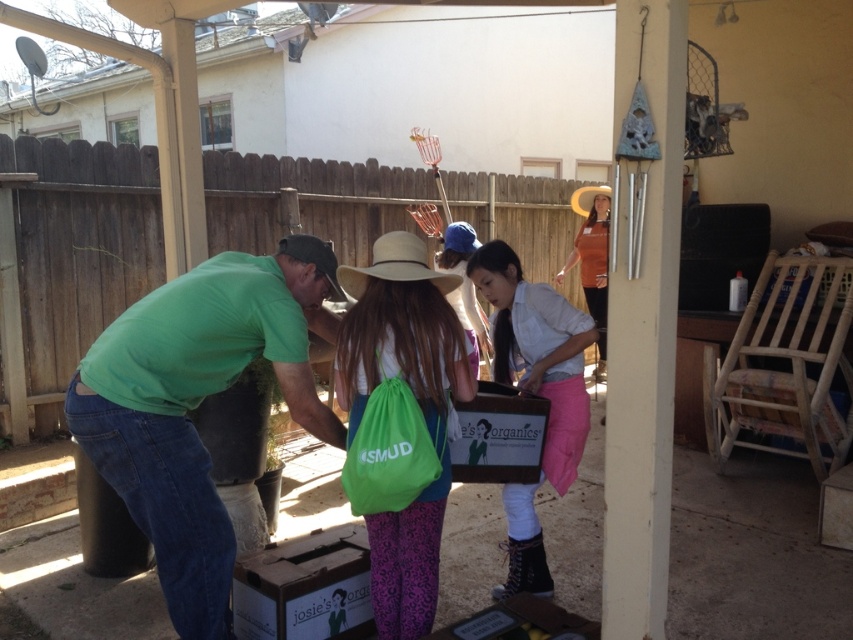
Does green matte shirt at center appear over green fabric bag at center?

Correct, green matte shirt at center is located above green fabric bag at center.

Is point (196, 449) farther from viewer compared to point (392, 554)?

No, (196, 449) is in front of (392, 554).

Between point (257, 268) and point (434, 556), which one is positioned in front?

Point (257, 268) is more forward.

At what (x,y) coordinates should I click in order to perform the action: click on green matte shirt at center. Please return your answer as a coordinate pair (x, y). Looking at the image, I should click on (198, 403).

Who is shorter, green fabric bag at center or light brown straw cowboy hat at upper center?

light brown straw cowboy hat at upper center is shorter.

Is green fabric bag at center in front of light brown straw cowboy hat at upper center?

Yes, green fabric bag at center is in front of light brown straw cowboy hat at upper center.

At what (x,y) coordinates should I click in order to perform the action: click on green fabric bag at center. Please return your answer as a coordinate pair (x, y). The height and width of the screenshot is (640, 853). Looking at the image, I should click on (413, 406).

At what (x,y) coordinates should I click in order to perform the action: click on green fabric bag at center. Please return your answer as a coordinate pair (x, y). This screenshot has height=640, width=853. Looking at the image, I should click on click(x=413, y=406).

Does beige straw hat at center have a larger size compared to light brown straw cowboy hat at upper center?

No, beige straw hat at center is not bigger than light brown straw cowboy hat at upper center.

Can you confirm if beige straw hat at center is wider than light brown straw cowboy hat at upper center?

Yes, beige straw hat at center is wider than light brown straw cowboy hat at upper center.

Which is behind, point (405, 275) or point (581, 196)?

The point (581, 196) is more distant.

Image resolution: width=853 pixels, height=640 pixels. Identify the location of beige straw hat at center. (395, 266).